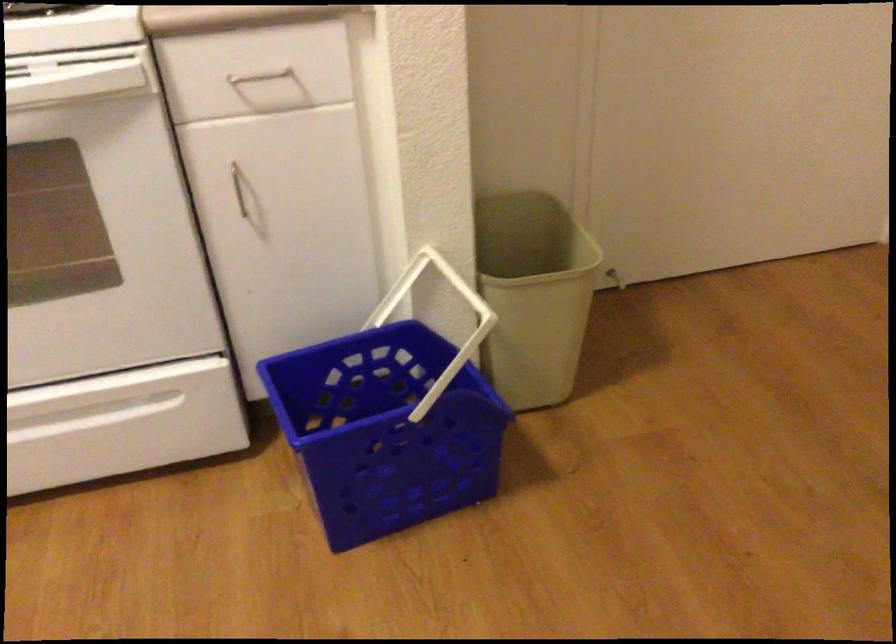
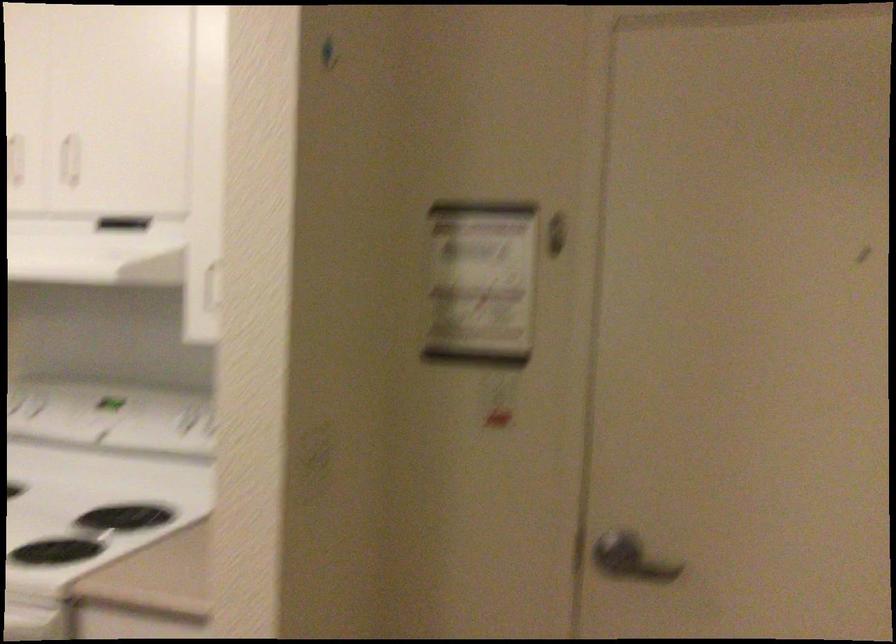
The images are taken continuously from a first-person perspective. In which direction is your viewpoint rotating?

The camera's rotation is toward left-up.